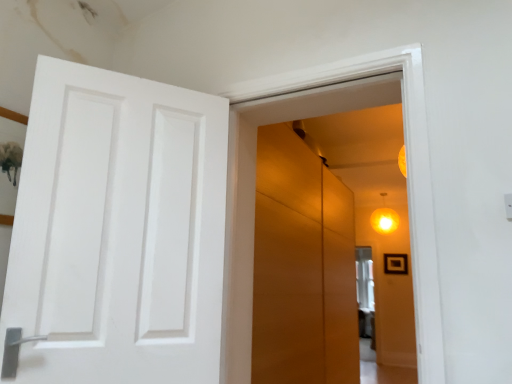
Question: Does point (374, 228) appear closer or farther from the camera than point (269, 135)?

Choices:
 (A) farther
 (B) closer

Answer: (A)

Question: In terms of height, does matte yellow globe light at upper right look taller or shorter compared to matte orange cabinet at center?

Choices:
 (A) tall
 (B) short

Answer: (B)

Question: Which is farther from the black matte picture frame at upper right?

Choices:
 (A) matte orange cabinet at center
 (B) matte yellow globe light at upper right

Answer: (A)

Question: Which is farther from the matte orange cabinet at center?

Choices:
 (A) matte yellow globe light at upper right
 (B) black matte picture frame at upper right

Answer: (B)